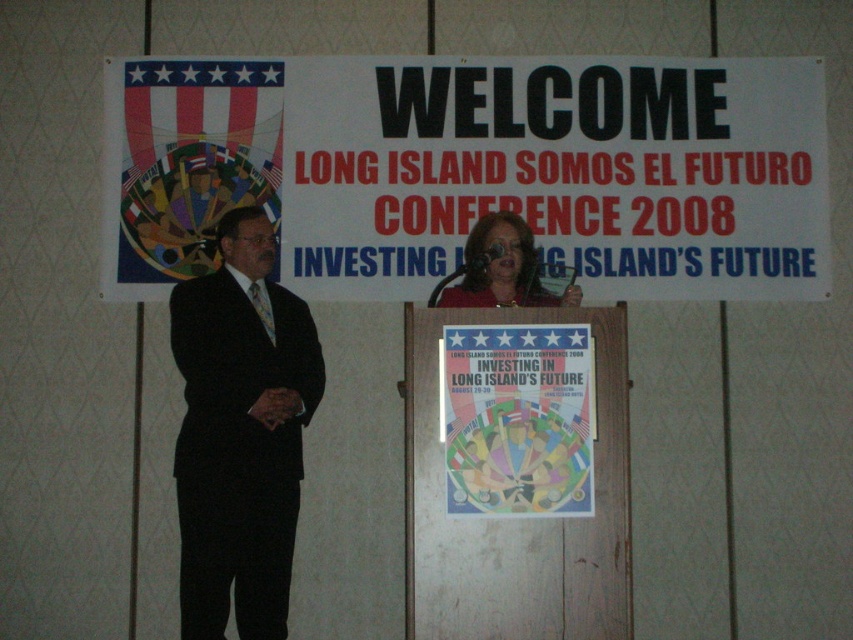
Between black suit at left and matte red blouse at center, which one appears on the right side from the viewer's perspective?

Positioned to the right is matte red blouse at center.

Who is more forward, (x=187, y=388) or (x=450, y=292)?

Point (x=187, y=388)

Find the location of `black suit at left`. black suit at left is located at coordinates (241, 433).

Is white paper sign at upper center closer to camera compared to metallic poster at center?

No, white paper sign at upper center is further to the viewer.

Who is lower down, white paper sign at upper center or metallic poster at center?

metallic poster at center

Which is in front, point (260, 138) or point (469, 445)?

Positioned in front is point (469, 445).

The width and height of the screenshot is (853, 640). In order to click on white paper sign at upper center in this screenshot , I will do `click(473, 170)`.

Between wooden poster at center and metallic poster at center, which one appears on the right side from the viewer's perspective?

From the viewer's perspective, wooden poster at center appears more on the right side.

The height and width of the screenshot is (640, 853). What do you see at coordinates (515, 518) in the screenshot?
I see `wooden poster at center` at bounding box center [515, 518].

Is point (415, 561) closer to camera compared to point (515, 499)?

No, (415, 561) is behind (515, 499).

Locate an element on the screen. This screenshot has width=853, height=640. wooden poster at center is located at coordinates click(x=515, y=518).